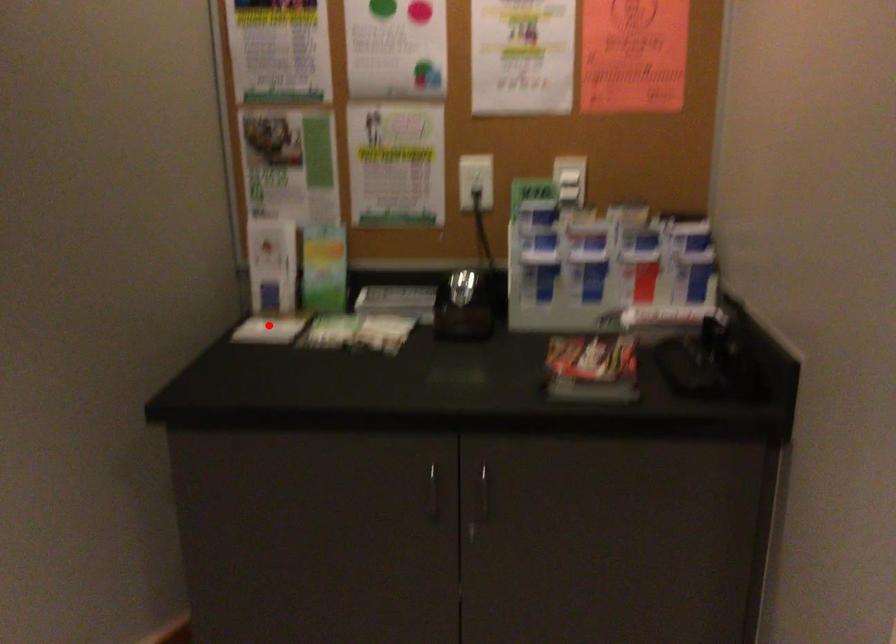
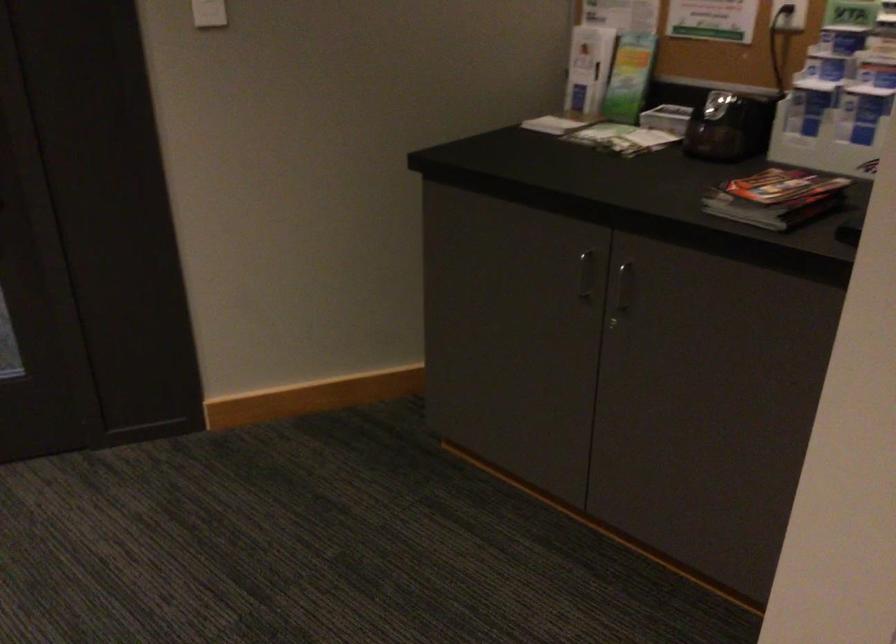
Question: I am providing you with two images of the same scene from different viewpoints. In image1, a red point is highlighted. Considering the same 3D point in image2, which of the following is correct?

Choices:
 (A) It is closer
 (B) It is farther

Answer: (B)